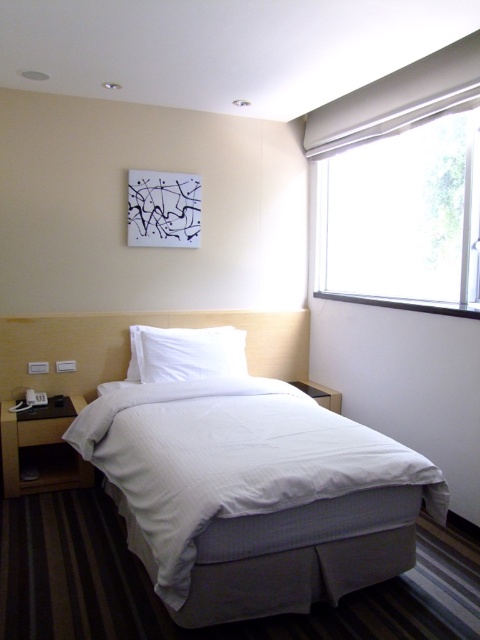
You are standing in the middle of the bedroom and want to know the relative positions of the white matte window at upper right and the white soft pillow at center. Which one is located to the right of the other?

The white matte window at upper right is to the right of the white soft pillow at center.

You are organizing the bed in the minimalist bedroom. You have to place the white textured bedsheet at center and the white soft pillow at center. Which object has a greater width?

The white textured bedsheet at center has a greater width than the white soft pillow at center.